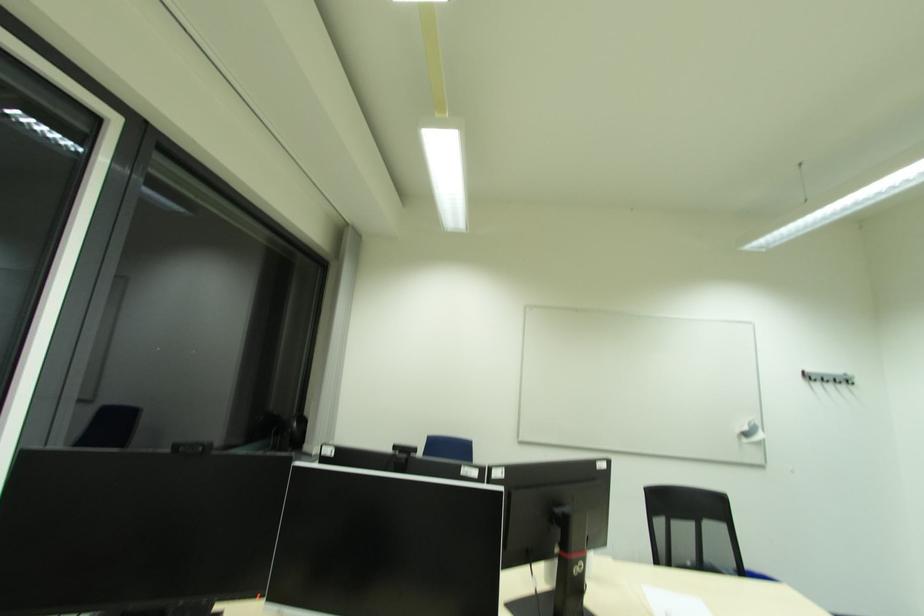
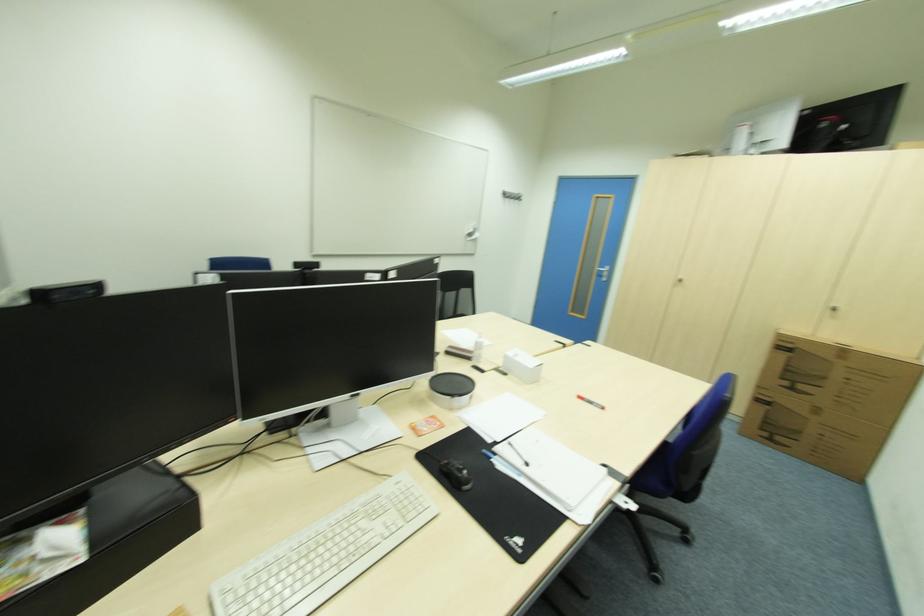
Looking at this image, based on the continuous images, in which direction is the camera rotating?

The rotation direction of the camera is right-down.